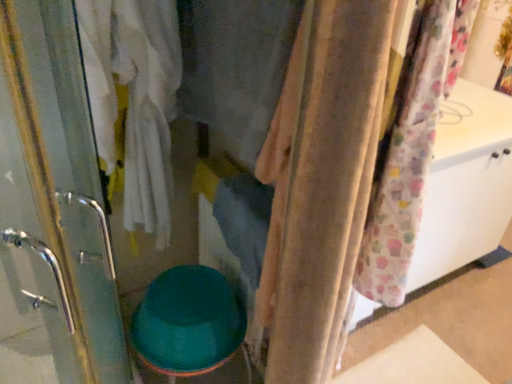
Question: From a real-world perspective, is teal glossy toilet bowl at center under velvet fabric at center?

Choices:
 (A) no
 (B) yes

Answer: (B)

Question: Is teal glossy toilet bowl at center to the left of velvet fabric at center from the viewer's perspective?

Choices:
 (A) yes
 (B) no

Answer: (A)

Question: Is teal glossy toilet bowl at center thinner than velvet fabric at center?

Choices:
 (A) yes
 (B) no

Answer: (B)

Question: Could you tell me if teal glossy toilet bowl at center is facing velvet fabric at center?

Choices:
 (A) yes
 (B) no

Answer: (B)

Question: Does teal glossy toilet bowl at center have a lesser height compared to velvet fabric at center?

Choices:
 (A) no
 (B) yes

Answer: (B)

Question: Is the surface of teal glossy toilet bowl at center in direct contact with velvet fabric at center?

Choices:
 (A) yes
 (B) no

Answer: (B)

Question: Does beige fabric curtain at center have a greater height compared to teal glossy toilet bowl at center?

Choices:
 (A) yes
 (B) no

Answer: (A)

Question: Is beige fabric curtain at center bigger than teal glossy toilet bowl at center?

Choices:
 (A) yes
 (B) no

Answer: (B)

Question: From the image's perspective, is beige fabric curtain at center under teal glossy toilet bowl at center?

Choices:
 (A) yes
 (B) no

Answer: (B)

Question: Considering the relative positions of beige fabric curtain at center and teal glossy toilet bowl at center in the image provided, is beige fabric curtain at center to the right of teal glossy toilet bowl at center from the viewer's perspective?

Choices:
 (A) yes
 (B) no

Answer: (A)

Question: Could you tell me if beige fabric curtain at center is turned towards teal glossy toilet bowl at center?

Choices:
 (A) yes
 (B) no

Answer: (B)

Question: From a real-world perspective, does beige fabric curtain at center stand above teal glossy toilet bowl at center?

Choices:
 (A) no
 (B) yes

Answer: (B)

Question: Does teal glossy toilet bowl at center have a smaller size compared to beige fabric curtain at center?

Choices:
 (A) yes
 (B) no

Answer: (B)